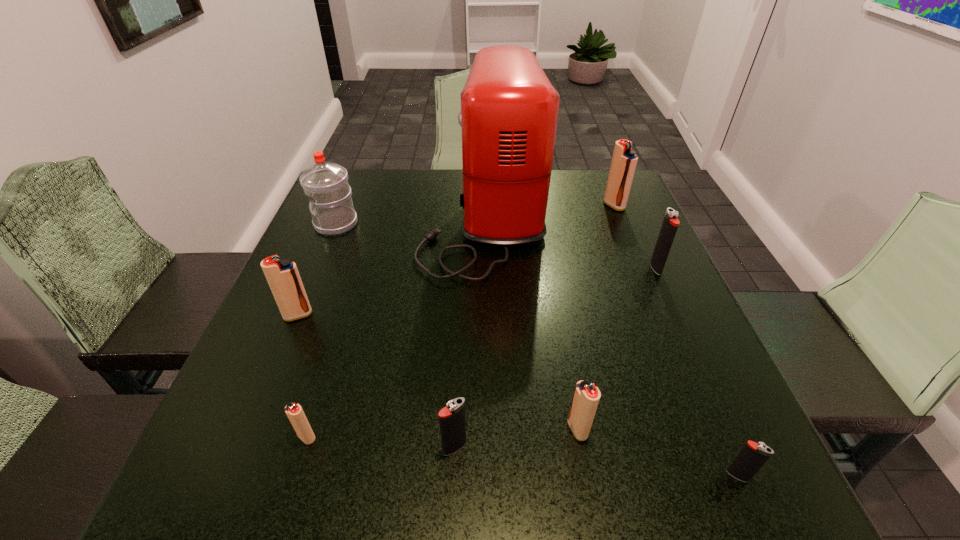
Locate an element on the screen. This screenshot has width=960, height=540. free location located 0.240m on the front of the farthest igniter is located at coordinates (641, 272).

Locate an element on the screen. vacant region located on the right of the second biggest red igniter is located at coordinates (386, 315).

What are the coordinates of `free spot located 0.080m on the back of the sixth nearest igniter` in the screenshot? It's located at (643, 239).

This screenshot has height=540, width=960. I want to click on vacant space situated on the left of the fifth igniter from right to left, so click(x=397, y=447).

Identify the location of free space located on the back of the fourth igniter from left to right. This screenshot has width=960, height=540. 547,260.

Find the location of a particular element. This screenshot has height=540, width=960. free space located on the back of the second igniter from left to right is located at coordinates (344, 318).

Where is `vacant space located 0.380m on the left of the nearest black igniter`? vacant space located 0.380m on the left of the nearest black igniter is located at coordinates (468, 475).

Identify the location of kitchen mixer located in the far edge section of the desktop. (509, 109).

This screenshot has width=960, height=540. What are the coordinates of `water bottle at the far edge` in the screenshot? It's located at (326, 184).

Locate an element on the screen. This screenshot has width=960, height=540. igniter that is at the far edge is located at coordinates (624, 161).